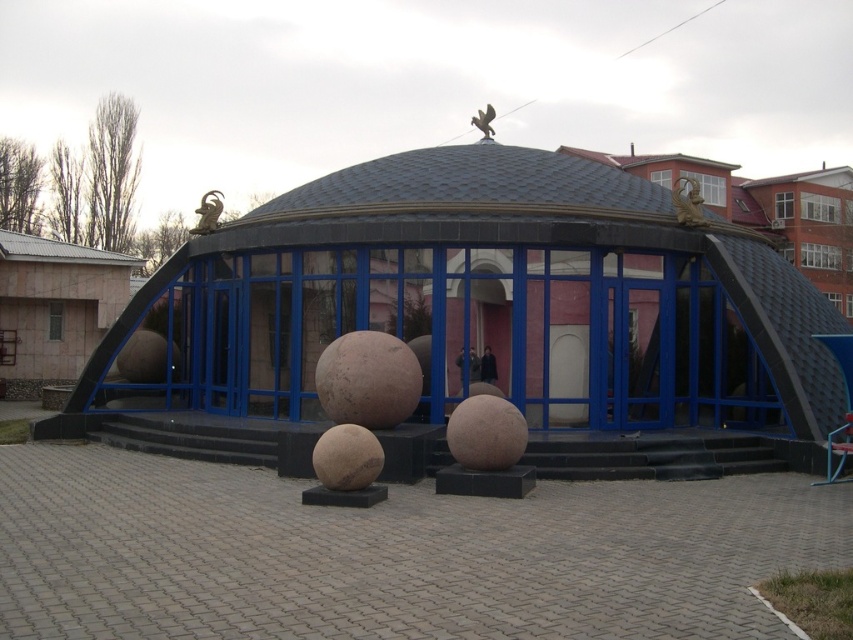
Between point (561, 298) and point (492, 115), which one is positioned behind?

Point (492, 115)

In order to click on glossy metallic dome at center in this screenshot , I will do `click(489, 300)`.

At what (x,y) coordinates should I click in order to perform the action: click on glossy metallic dome at center. Please return your answer as a coordinate pair (x, y). Looking at the image, I should click on (489, 300).

Is glossy metallic dome at center below gold metallic ram at upper center?

Yes, glossy metallic dome at center is below gold metallic ram at upper center.

Which is below, glossy metallic dome at center or gold metallic ram at upper center?

glossy metallic dome at center is lower down.

Between point (735, 259) and point (209, 204), which one is positioned behind?

Positioned behind is point (209, 204).

Identify the location of glossy metallic dome at center. The width and height of the screenshot is (853, 640). (489, 300).

Between point (556, 426) and point (679, 192), which one is positioned behind?

The point (679, 192) is more distant.

Is point (236, 269) closer to camera compared to point (683, 189)?

No, it is behind (683, 189).

Who is more distant from viewer, [180,289] or [679,224]?

The point [180,289] is more distant.

The height and width of the screenshot is (640, 853). In order to click on glossy metallic dome at center in this screenshot , I will do `click(489, 300)`.